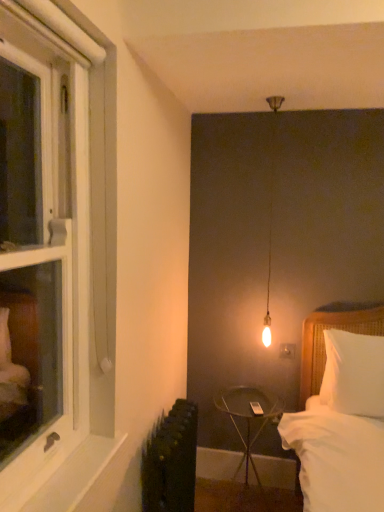
Question: Is white soft pillow at right closer to camera compared to white wood window at left?

Choices:
 (A) yes
 (B) no

Answer: (B)

Question: Considering the relative positions of white soft pillow at right and white wood window at left in the image provided, is white soft pillow at right to the right of white wood window at left from the viewer's perspective?

Choices:
 (A) yes
 (B) no

Answer: (A)

Question: Is white soft pillow at right oriented away from white wood window at left?

Choices:
 (A) yes
 (B) no

Answer: (B)

Question: Considering the relative sizes of white soft pillow at right and white wood window at left in the image provided, is white soft pillow at right shorter than white wood window at left?

Choices:
 (A) yes
 (B) no

Answer: (A)

Question: Is white soft pillow at right next to white wood window at left and touching it?

Choices:
 (A) yes
 (B) no

Answer: (B)

Question: Is white soft pillow at right further to the viewer compared to white wood window at left?

Choices:
 (A) no
 (B) yes

Answer: (B)

Question: Could metallic black side table at center be considered to be inside matte white outlet at center-right?

Choices:
 (A) no
 (B) yes

Answer: (A)

Question: Are matte white outlet at center-right and metallic black side table at center beside each other?

Choices:
 (A) no
 (B) yes

Answer: (A)

Question: Is matte white outlet at center-right bigger than metallic black side table at center?

Choices:
 (A) no
 (B) yes

Answer: (A)

Question: From the image's perspective, is matte white outlet at center-right located above metallic black side table at center?

Choices:
 (A) no
 (B) yes

Answer: (B)

Question: Would you say matte white outlet at center-right is outside metallic black side table at center?

Choices:
 (A) yes
 (B) no

Answer: (A)

Question: Is there a large distance between matte white outlet at center-right and metallic black side table at center?

Choices:
 (A) no
 (B) yes

Answer: (A)

Question: Is metallic black side table at center taller than white painted wood at lower left?

Choices:
 (A) no
 (B) yes

Answer: (B)